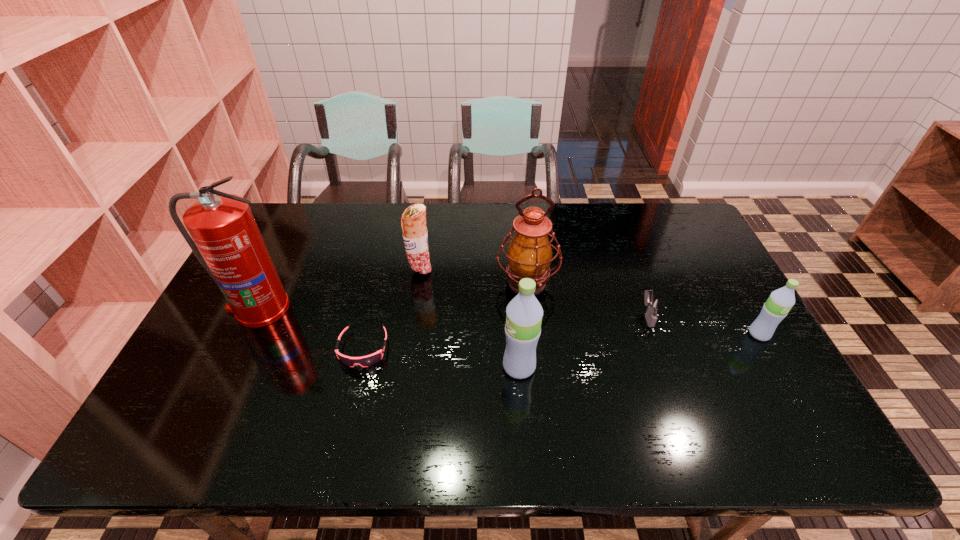
Image resolution: width=960 pixels, height=540 pixels. In order to click on vacant region between the third shortest object and the taller water bottle in this screenshot , I will do `click(639, 350)`.

Image resolution: width=960 pixels, height=540 pixels. What are the coordinates of `free point between the oil lamp and the right water bottle` in the screenshot? It's located at (643, 308).

Where is `vacant area between the sixth object from left to right and the rightmost object`? This screenshot has height=540, width=960. vacant area between the sixth object from left to right and the rightmost object is located at coordinates (703, 325).

Find the location of `vacant area between the sixth object from right to left and the fourth shortest object`. vacant area between the sixth object from right to left and the fourth shortest object is located at coordinates (392, 309).

Locate an element on the screen. unoccupied position between the sixth object from left to right and the fire extinguisher is located at coordinates (453, 312).

What are the coordinates of `free space between the leftmost object and the second object from left to right` in the screenshot? It's located at (311, 328).

Select which object is the fourth closest to the rightmost object. Please provide its 2D coordinates. Your answer should be formatted as a tuple, i.e. [(x, y)], where the tuple contains the x and y coordinates of a point satisfying the conditions above.

[(413, 222)]

Locate which object ranks fourth in proximity to the fourth tallest object. Please provide its 2D coordinates. Your answer should be formatted as a tuple, i.e. [(x, y)], where the tuple contains the x and y coordinates of a point satisfying the conditions above.

[(524, 313)]

Identify the location of free space that satisfies the following two spatial constraints: 1. on the instruction side of the nearer water bottle; 2. on the right side of the leftmost object. (231, 367).

Where is `vacant area in the image that satisfies the following two spatial constraints: 1. on the front side of the sixth object from left to right; 2. on the right side of the oil lamp`? The width and height of the screenshot is (960, 540). vacant area in the image that satisfies the following two spatial constraints: 1. on the front side of the sixth object from left to right; 2. on the right side of the oil lamp is located at coordinates (531, 315).